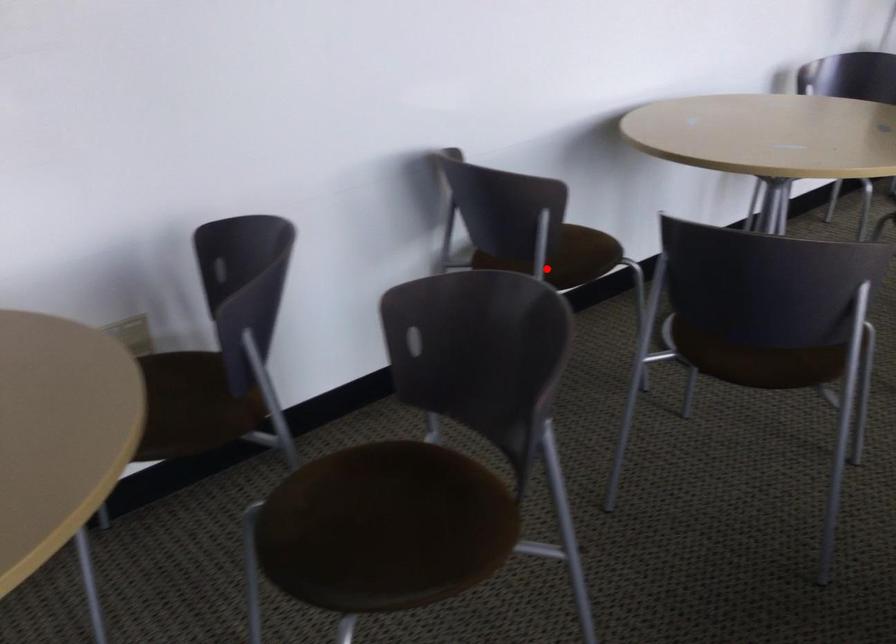
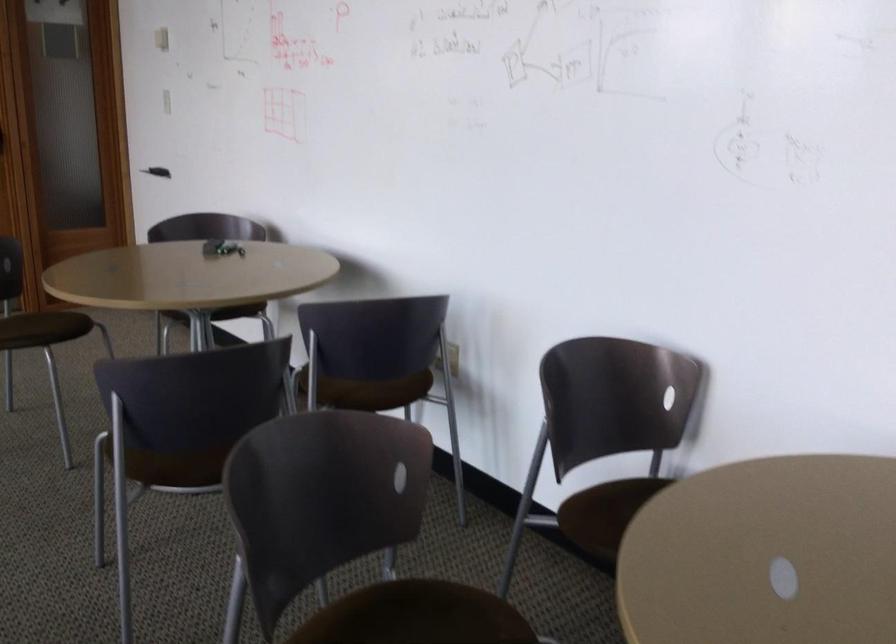
Locate, in the second image, the point that corresponds to the highlighted location in the first image.

(595, 514)